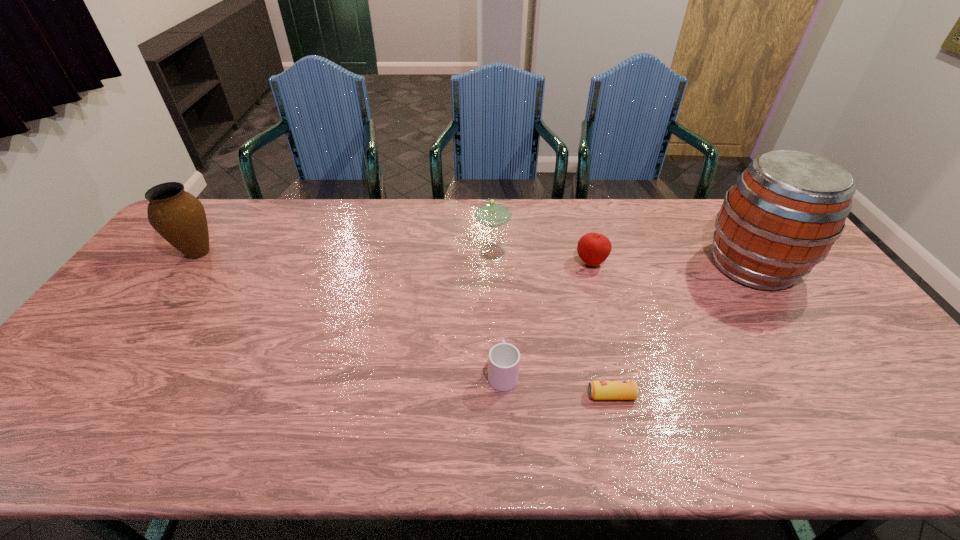
Locate an element on the screen. The image size is (960, 540). object at the far left corner is located at coordinates (179, 217).

The height and width of the screenshot is (540, 960). What are the coordinates of `object present at the far right corner` in the screenshot? It's located at (786, 210).

Find the location of a particular element. free space at the far edge is located at coordinates (347, 203).

Locate an element on the screen. vacant point at the near edge is located at coordinates (841, 450).

In the image, there is a desktop. At what (x,y) coordinates should I click in order to perform the action: click on vacant region at the left edge. Please return your answer as a coordinate pair (x, y). Image resolution: width=960 pixels, height=540 pixels. Looking at the image, I should click on (165, 302).

What are the coordinates of `vacant area at the right edge` in the screenshot? It's located at (819, 328).

Find the location of a particular element. The height and width of the screenshot is (540, 960). vacant space at the near right corner is located at coordinates (928, 447).

Locate an element on the screen. The height and width of the screenshot is (540, 960). free space between the martini and the cup is located at coordinates (499, 313).

Identify the location of vacant space that is in between the tallest object and the leftmost object. The width and height of the screenshot is (960, 540). (475, 259).

You are a GUI agent. You are given a task and a screenshot of the screen. Output one action in this format:
    pyautogui.click(x=<x>, y=<y>)
    Task: Click on the unoccupied area between the rightmost object and the martini
    The image size is (960, 540).
    Given the screenshot: What is the action you would take?
    pyautogui.click(x=624, y=259)